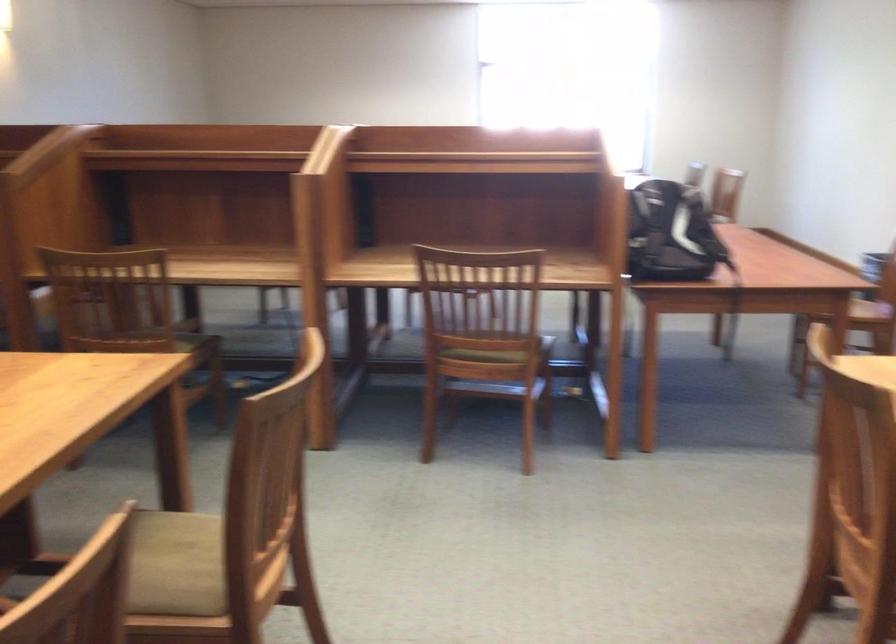
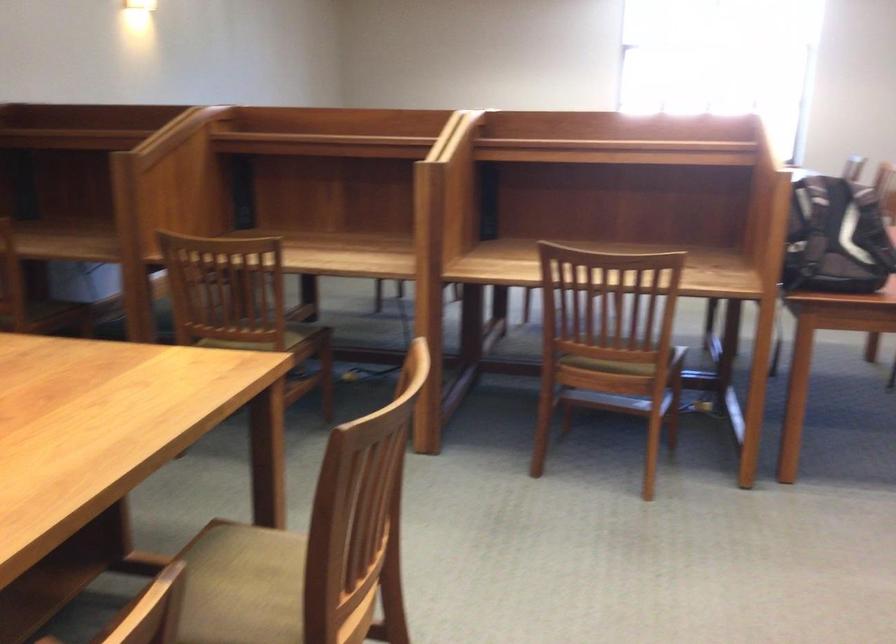
Question: How did the camera likely rotate?

Choices:
 (A) Left
 (B) Right
 (C) Up
 (D) Down

Answer: (A)